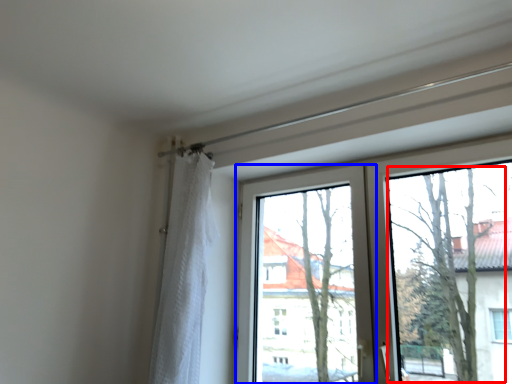
Question: Which object appears closest to the camera in this image, tree (highlighted by a red box) or window screen (highlighted by a blue box)?

Choices:
 (A) tree
 (B) window screen

Answer: (A)